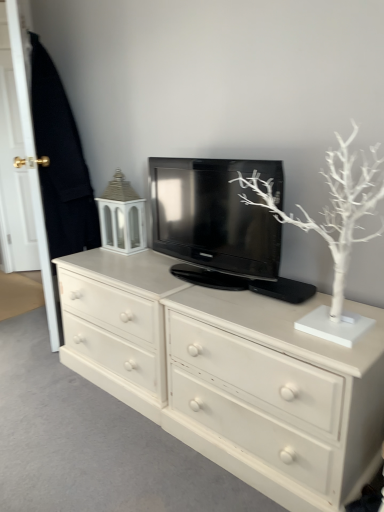
Question: From a real-world perspective, does black glossy television at center stand above white wood door at left?

Choices:
 (A) no
 (B) yes

Answer: (A)

Question: Is black glossy television at center facing towards white wood door at left?

Choices:
 (A) no
 (B) yes

Answer: (A)

Question: Can you confirm if black glossy television at center is positioned to the left of white wood door at left?

Choices:
 (A) no
 (B) yes

Answer: (A)

Question: Considering the relative sizes of black glossy television at center and white wood door at left in the image provided, is black glossy television at center shorter than white wood door at left?

Choices:
 (A) no
 (B) yes

Answer: (B)

Question: From the image's perspective, is black glossy television at center on white wood door at left?

Choices:
 (A) yes
 (B) no

Answer: (B)

Question: From the image's perspective, is white wood door at left positioned above or below white matte tree at upper right?

Choices:
 (A) above
 (B) below

Answer: (A)

Question: Does point pyautogui.click(x=18, y=66) appear closer or farther from the camera than point pyautogui.click(x=370, y=160)?

Choices:
 (A) farther
 (B) closer

Answer: (A)

Question: From a real-world perspective, is white wood door at left positioned above or below white matte tree at upper right?

Choices:
 (A) below
 (B) above

Answer: (B)

Question: Looking at the image, does white wood door at left seem bigger or smaller compared to white matte tree at upper right?

Choices:
 (A) small
 (B) big

Answer: (B)

Question: In the image, is black glossy television at center on the left side or the right side of white wood door at left?

Choices:
 (A) left
 (B) right

Answer: (B)

Question: From the image's perspective, relative to white wood door at left, is black glossy television at center above or below?

Choices:
 (A) above
 (B) below

Answer: (B)

Question: From their relative heights in the image, would you say black glossy television at center is taller or shorter than white wood door at left?

Choices:
 (A) short
 (B) tall

Answer: (A)

Question: In terms of width, does black glossy television at center look wider or thinner when compared to white wood door at left?

Choices:
 (A) thin
 (B) wide

Answer: (B)

Question: From a real-world perspective, relative to white matte tree at upper right, is black glossy television at center vertically above or below?

Choices:
 (A) below
 (B) above

Answer: (A)

Question: Considering the relative positions of black glossy television at center and white matte tree at upper right in the image provided, is black glossy television at center to the left or to the right of white matte tree at upper right?

Choices:
 (A) right
 (B) left

Answer: (B)